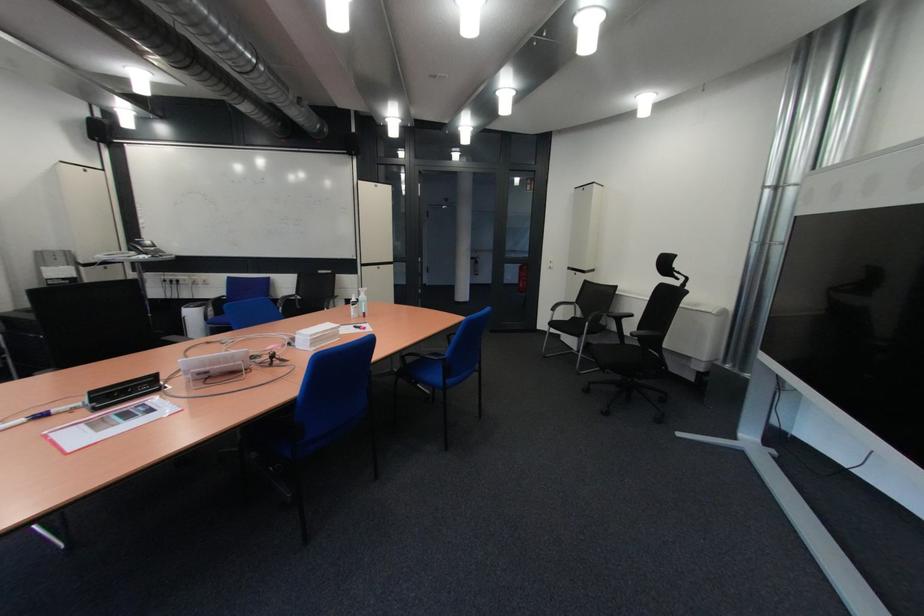
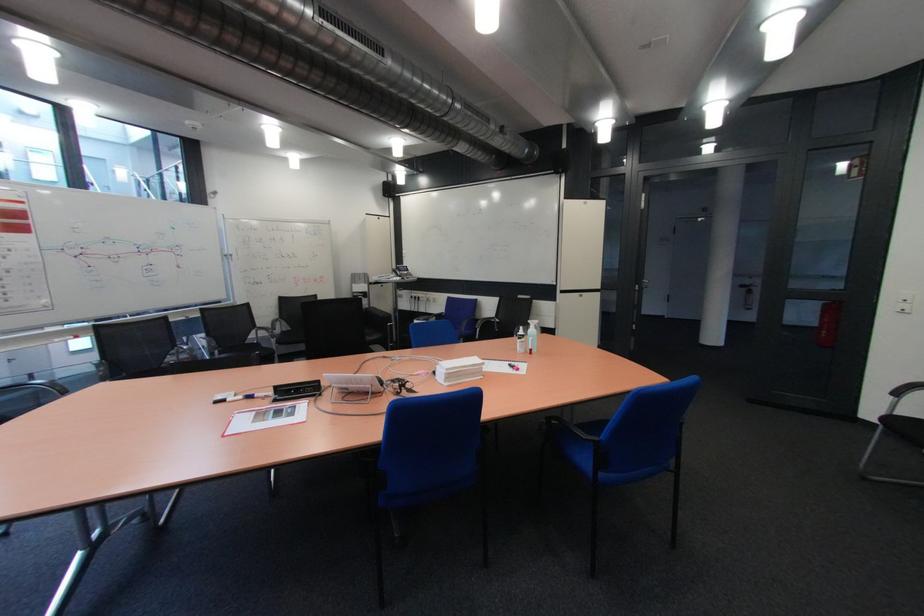
Question: The camera is either moving clockwise (left) or counter-clockwise (right) around the object. The first image is from the beginning of the video and the second image is from the end. Is the camera moving left or right when shooting the video?

Choices:
 (A) Left
 (B) Right

Answer: (B)